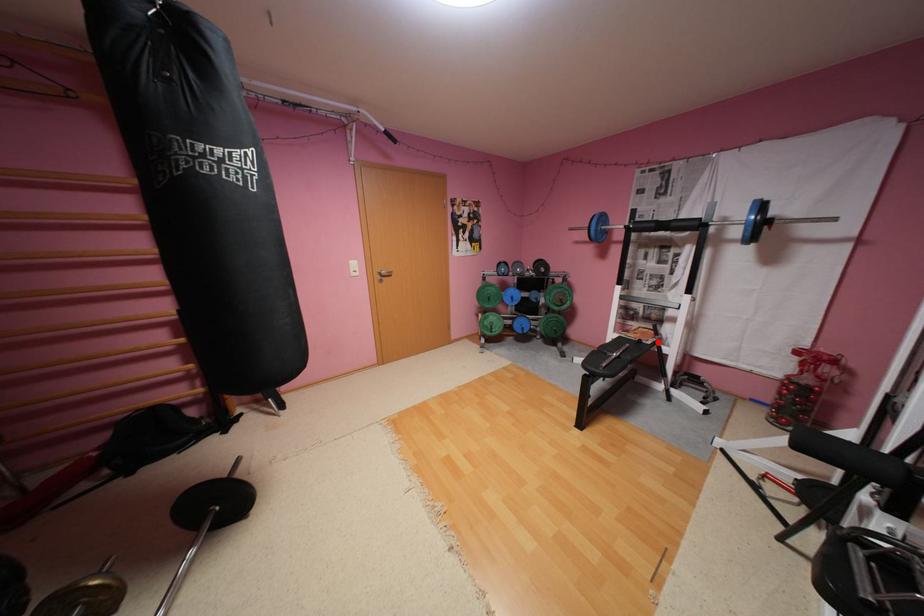
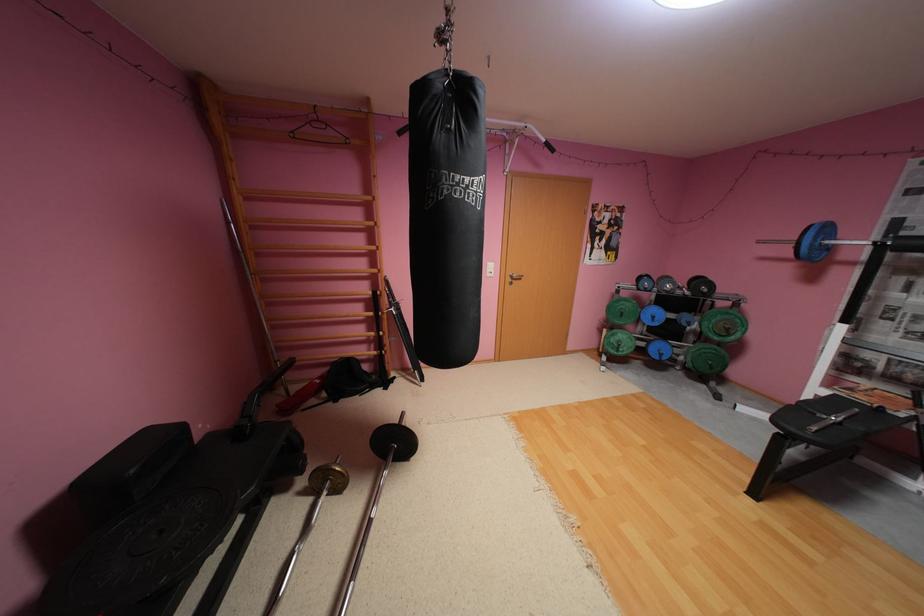
Locate, in the second image, the point that corresponds to the highlighted location in the first image.

(909, 415)